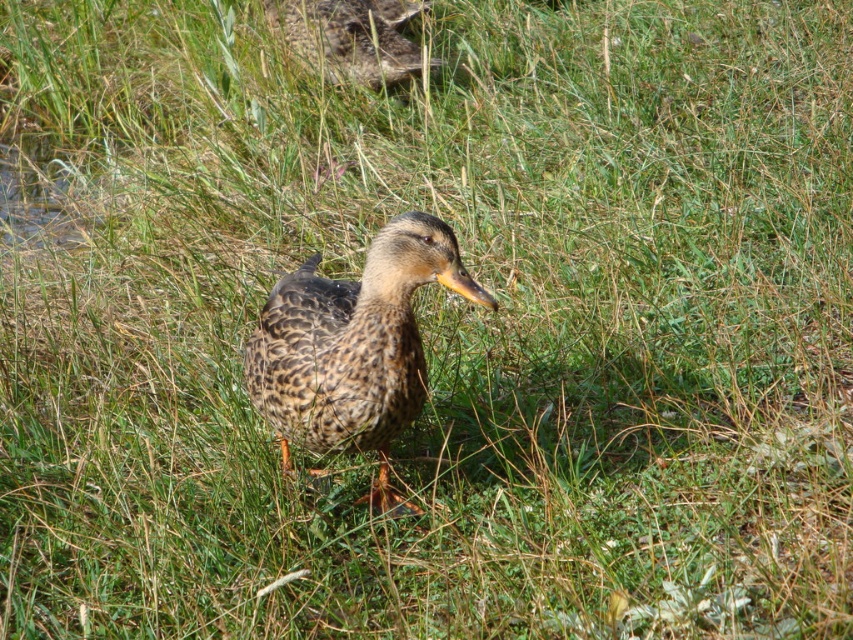
You are observing a duck in a grassy area. The duck has a mottled brown plumage with darker markings and is standing at the center. Can you determine the exact coordinates of the speckled feathered duck at center?

The speckled feathered duck at center is located at point (352, 348).

You are a birdwatcher observing two ducks in the image. The first is the speckled feathered duck at center, and the second is the speckled feathered duck at upper center. Which duck is positioned more to the right side of the image?

The speckled feathered duck at center is positioned more to the right side of the image compared to the speckled feathered duck at upper center.